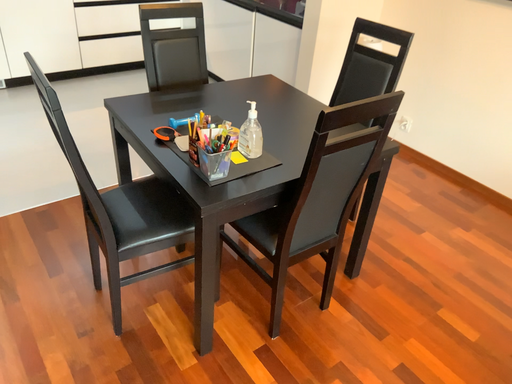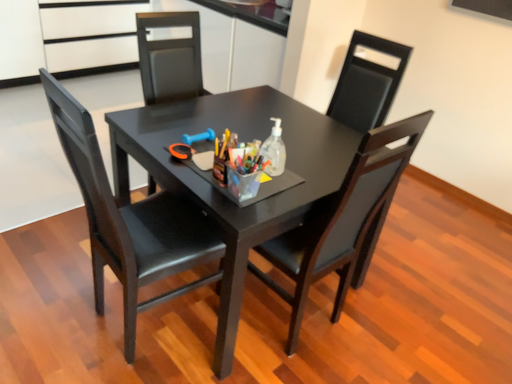
Question: Which way did the camera rotate in the video?

Choices:
 (A) rotated right
 (B) rotated left

Answer: (A)